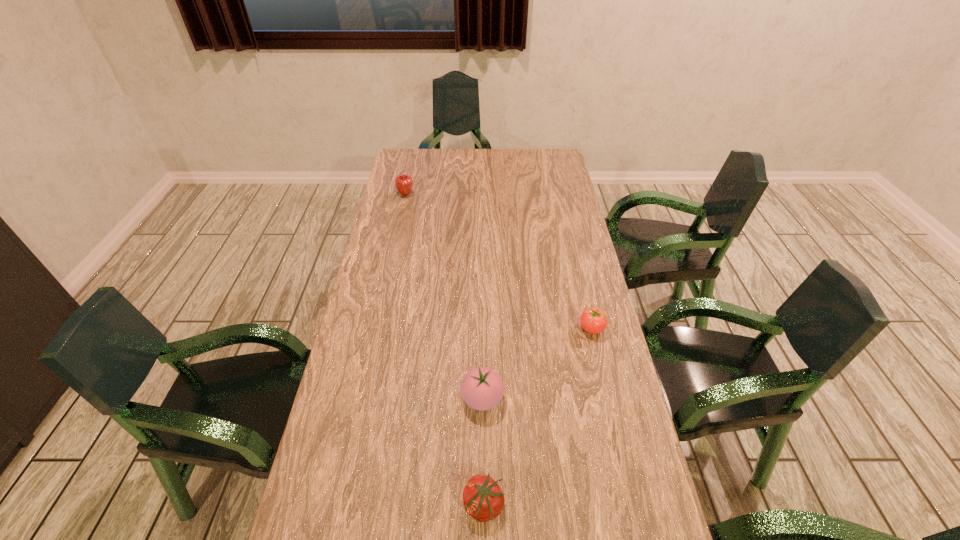
You are a GUI agent. You are given a task and a screenshot of the screen. Output one action in this format:
    pyautogui.click(x=<x>, y=<y>)
    Task: Click on the vacant space situated on the back of the nearest tomato
    
    Given the screenshot: What is the action you would take?
    pyautogui.click(x=483, y=348)

Locate an element on the screen. This screenshot has height=540, width=960. object that is positioned at the left edge is located at coordinates (404, 182).

I want to click on object present at the right edge, so click(x=593, y=320).

Locate an element on the screen. This screenshot has width=960, height=540. vacant point at the far edge is located at coordinates (505, 172).

Locate an element on the screen. The width and height of the screenshot is (960, 540). vacant space at the left edge is located at coordinates pyautogui.click(x=369, y=473).

In order to click on free region at the right edge of the desktop in this screenshot , I will do `click(564, 180)`.

Locate an element on the screen. Image resolution: width=960 pixels, height=540 pixels. vacant region at the far left corner of the desktop is located at coordinates (x=430, y=148).

Image resolution: width=960 pixels, height=540 pixels. Identify the location of unoccupied position between the farthest object and the farthest tomato. (498, 261).

Locate an element on the screen. The image size is (960, 540). free point between the nearest object and the rightmost tomato is located at coordinates (538, 417).

Locate an element on the screen. Image resolution: width=960 pixels, height=540 pixels. unoccupied position between the second farthest tomato and the rightmost tomato is located at coordinates (537, 363).